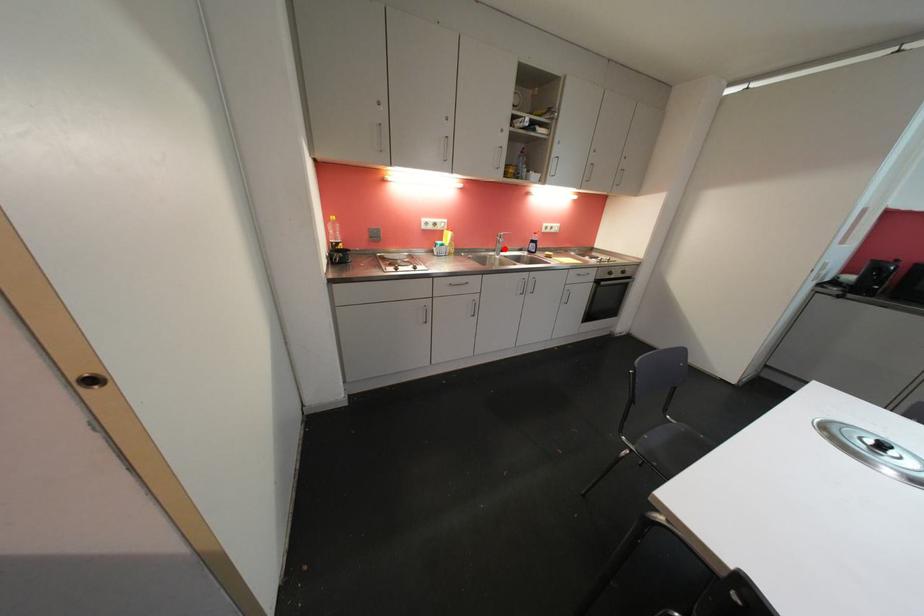
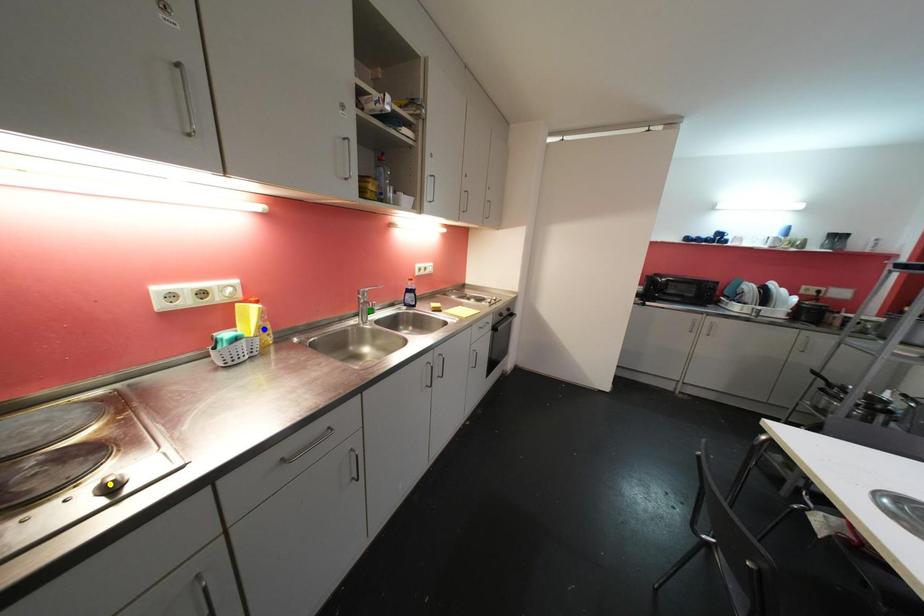
Question: I am providing you with two images of the same scene from different viewpoints. A red point is marked on the first image. You are given multiple points on the second image. Which point in image 2 is actually the same real-world point as the red point in image 1?

Choices:
 (A) blue point
 (B) yellow point
 (C) green point

Answer: (C)